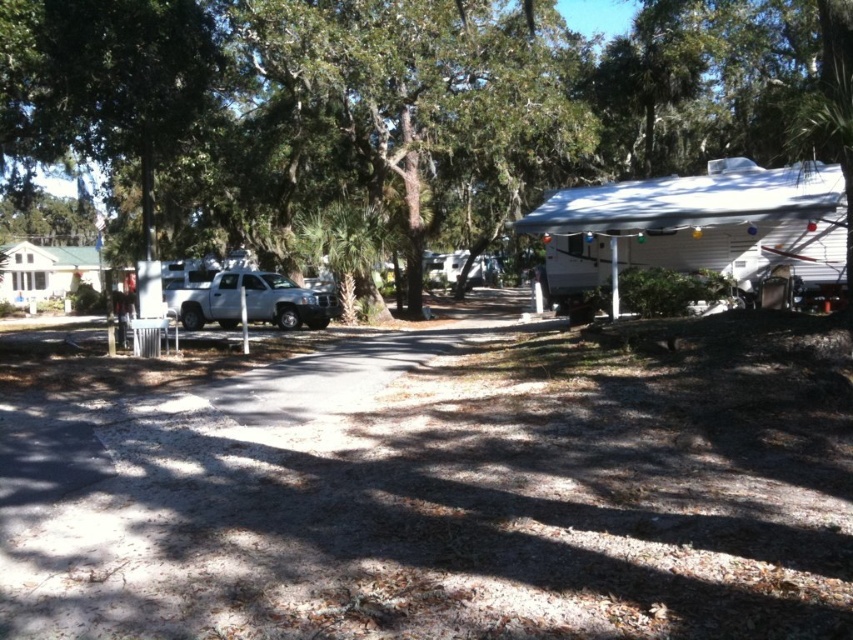
Question: Which point appears farthest from the camera in this image?

Choices:
 (A) (265, 300)
 (B) (175, 161)
 (C) (456, 68)
 (D) (581, 244)

Answer: (C)

Question: Which point is farther from the camera taking this photo?

Choices:
 (A) (595, 243)
 (B) (254, 285)

Answer: (B)

Question: Which is nearer to the silver metallic truck at center-left?

Choices:
 (A) green leafy tree at center
 (B) green leafy tree at upper center

Answer: (B)

Question: Observing the image, what is the correct spatial positioning of green leafy tree at upper center in reference to silver metallic truck at center-left?

Choices:
 (A) right
 (B) left

Answer: (A)

Question: Does green leafy tree at upper center appear on the right side of white matte camper at right?

Choices:
 (A) yes
 (B) no

Answer: (B)

Question: Can you confirm if green leafy tree at center is positioned to the left of green leafy tree at upper center?

Choices:
 (A) yes
 (B) no

Answer: (A)